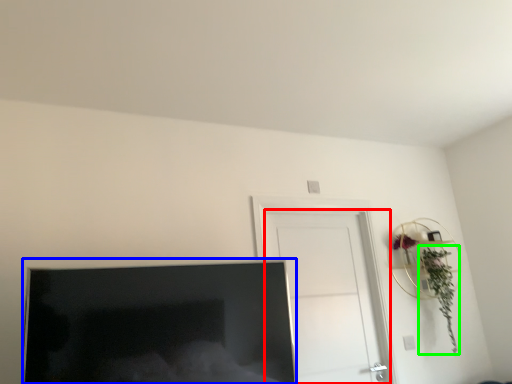
Question: Considering the real-world distances, which object is closest to door (highlighted by a red box)? television (highlighted by a blue box) or plant (highlighted by a green box).

Choices:
 (A) television
 (B) plant

Answer: (B)